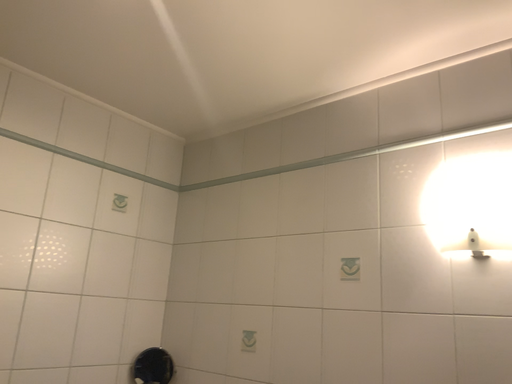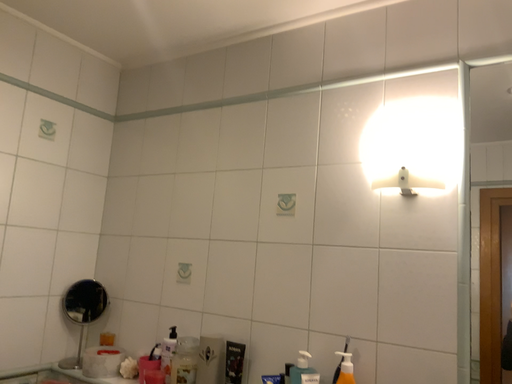
Question: How did the camera likely rotate when shooting the video?

Choices:
 (A) rotated left
 (B) rotated right

Answer: (B)